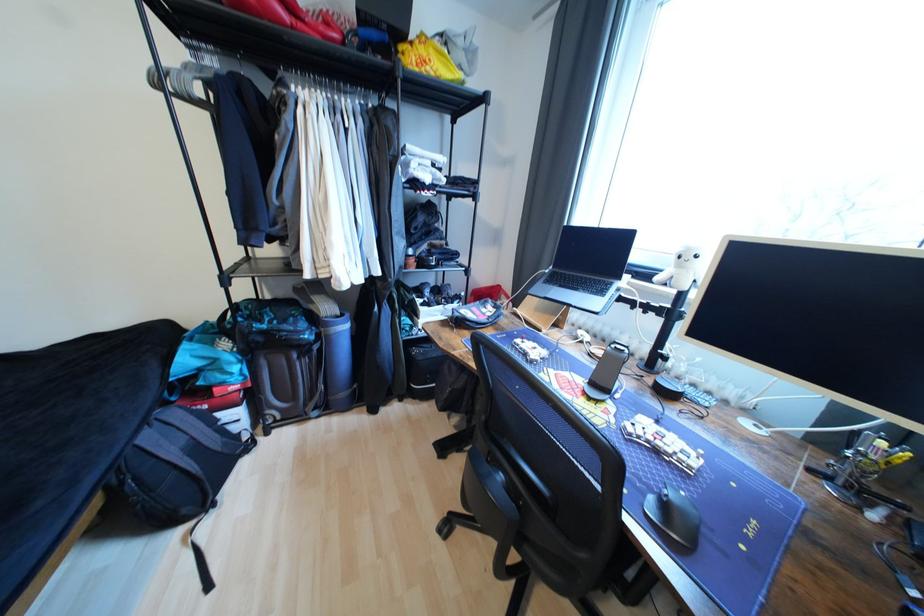
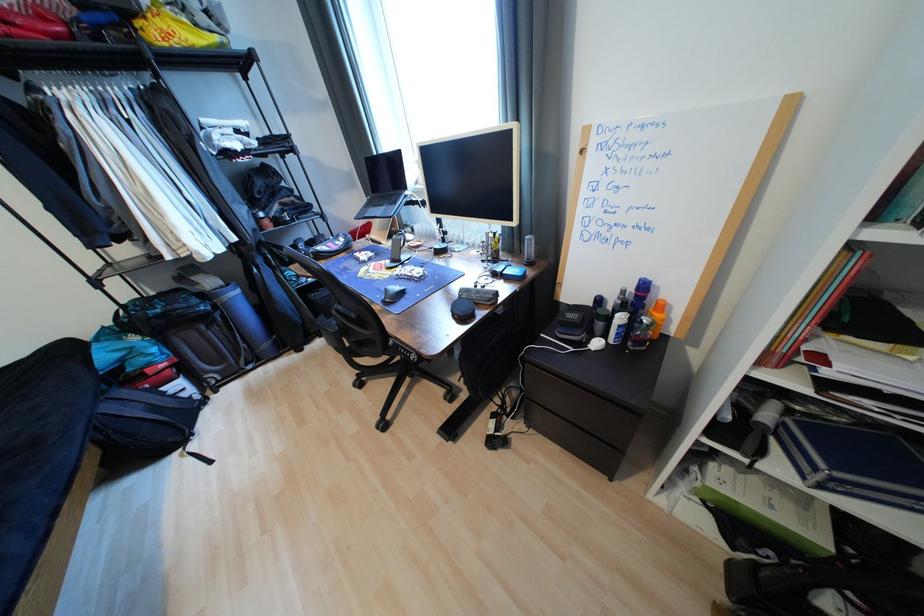
Question: I am providing you with two images of the same scene from different viewpoints. Which of the following objects are not visible in image2?

Choices:
 (A) top drawer pull
 (B) whiteboard handle
 (C) white stuffed toy
 (D) laptop computer

Answer: (C)